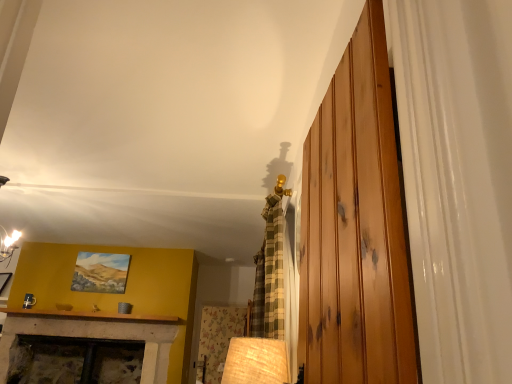
Question: Considering the relative sizes of matte oil painting at upper left and wooden at right in the image provided, is matte oil painting at upper left thinner than wooden at right?

Choices:
 (A) yes
 (B) no

Answer: (A)

Question: Is matte oil painting at upper left aimed at wooden at right?

Choices:
 (A) no
 (B) yes

Answer: (B)

Question: Is the position of matte oil painting at upper left less distant than that of wooden at right?

Choices:
 (A) no
 (B) yes

Answer: (A)

Question: Is wooden at right surrounded by matte oil painting at upper left?

Choices:
 (A) no
 (B) yes

Answer: (A)

Question: Considering the relative sizes of matte oil painting at upper left and wooden at right in the image provided, is matte oil painting at upper left wider than wooden at right?

Choices:
 (A) no
 (B) yes

Answer: (A)

Question: Are matte oil painting at upper left and wooden at right making contact?

Choices:
 (A) yes
 (B) no

Answer: (B)

Question: Is wooden at right wider than matte oil painting at upper left?

Choices:
 (A) yes
 (B) no

Answer: (A)

Question: From the image's perspective, is wooden at right beneath matte oil painting at upper left?

Choices:
 (A) yes
 (B) no

Answer: (B)

Question: Is wooden at right touching matte oil painting at upper left?

Choices:
 (A) no
 (B) yes

Answer: (A)

Question: Does wooden at right have a greater height compared to matte oil painting at upper left?

Choices:
 (A) yes
 (B) no

Answer: (A)

Question: Does wooden at right have a lesser width compared to matte oil painting at upper left?

Choices:
 (A) yes
 (B) no

Answer: (B)

Question: Considering the relative sizes of wooden at right and matte oil painting at upper left in the image provided, is wooden at right shorter than matte oil painting at upper left?

Choices:
 (A) yes
 (B) no

Answer: (B)

Question: From their relative heights in the image, would you say wooden at right is taller or shorter than matte oil painting at upper left?

Choices:
 (A) tall
 (B) short

Answer: (A)